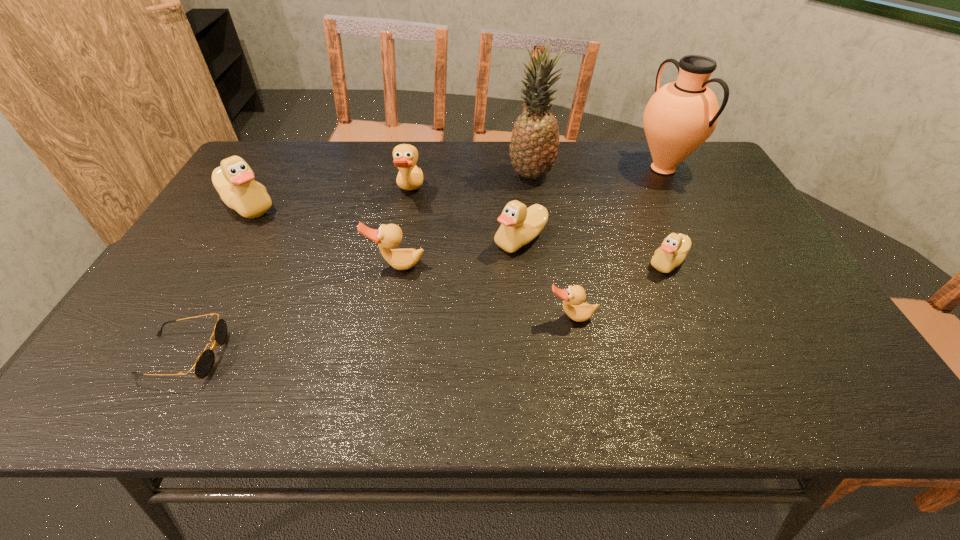
You are a GUI agent. You are given a task and a screenshot of the screen. Output one action in this format:
    pyautogui.click(x=<x>, y=<y>)
    Task: Click on the nearest duck
    
    Given the screenshot: What is the action you would take?
    pyautogui.click(x=573, y=297)

Locate an element on the screen. Image resolution: width=960 pixels, height=540 pixels. sunglasses is located at coordinates (204, 364).

What are the coordinates of `the nearest object` in the screenshot? It's located at (204, 364).

Where is `free space located 0.200m on the front of the pineapple`? This screenshot has height=540, width=960. free space located 0.200m on the front of the pineapple is located at coordinates (540, 231).

The image size is (960, 540). In order to click on free spot located on the right of the eighth shortest object in this screenshot , I will do `click(713, 168)`.

At what (x,y) coordinates should I click in order to perform the action: click on vacant area situated at the beak of the leftmost beige duck. Please return your answer as a coordinate pair (x, y). This screenshot has height=540, width=960. Looking at the image, I should click on (173, 329).

The width and height of the screenshot is (960, 540). What are the coordinates of `vacant space located on the beak of the biggest tan duck` in the screenshot? It's located at (457, 192).

The width and height of the screenshot is (960, 540). What are the coordinates of `blank space located at the beak of the second beige duck from right to left` in the screenshot? It's located at (411, 240).

Locate an element on the screen. The width and height of the screenshot is (960, 540). vacant space located at the beak of the second beige duck from right to left is located at coordinates (388, 240).

Where is `vacant space located at the beak of the second beige duck from right to left`? The image size is (960, 540). vacant space located at the beak of the second beige duck from right to left is located at coordinates (373, 240).